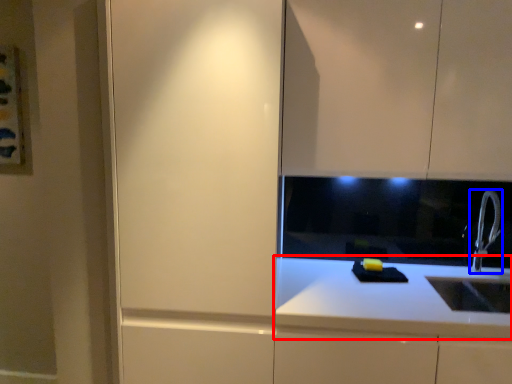
Question: Which point is further to the camera, countertop (highlighted by a red box) or tap (highlighted by a blue box)?

Choices:
 (A) countertop
 (B) tap

Answer: (B)